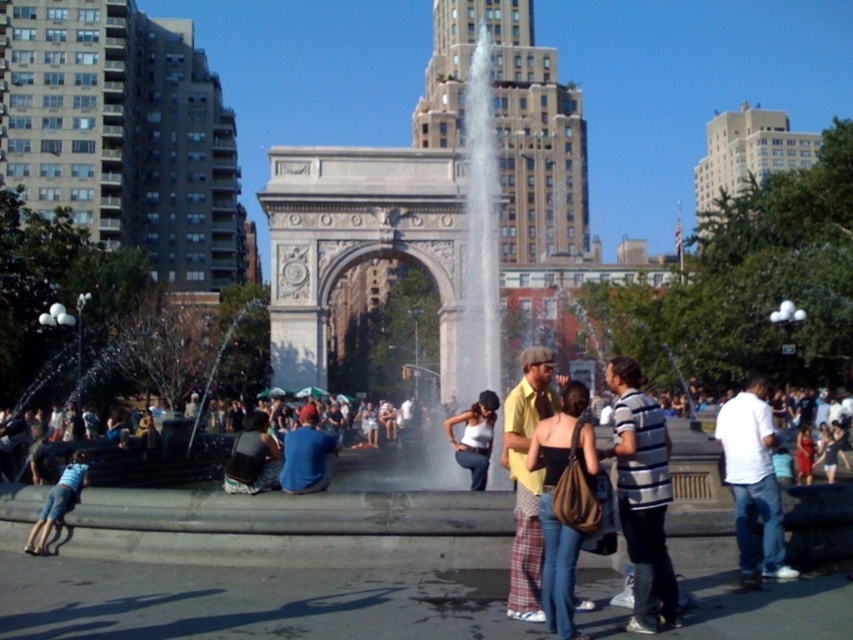
Can you confirm if white cotton shirt at center-right is wider than blue cotton shirt at center?

No.

Consider the image. Is white cotton shirt at center-right below blue cotton shirt at center?

Correct, white cotton shirt at center-right is located below blue cotton shirt at center.

Is point (772, 577) closer to camera compared to point (305, 456)?

Yes, point (772, 577) is closer to viewer.

You are a GUI agent. You are given a task and a screenshot of the screen. Output one action in this format:
    pyautogui.click(x=<x>, y=<y>)
    Task: Click on the white cotton shirt at center-right
    The width and height of the screenshot is (853, 640).
    Given the screenshot: What is the action you would take?
    pyautogui.click(x=752, y=481)

Does matte brown shoulder bag at center have a smaller size compared to blue cotton shirt at center?

Indeed, matte brown shoulder bag at center has a smaller size compared to blue cotton shirt at center.

Who is more forward, (572,602) or (312,436)?

Point (572,602) is in front.

I want to click on matte brown shoulder bag at center, so click(x=553, y=502).

Is striped cotton shirt at center bigger than yellow cotton shirt at center?

No, striped cotton shirt at center is not bigger than yellow cotton shirt at center.

Is striped cotton shirt at center in front of yellow cotton shirt at center?

Yes, it is in front of yellow cotton shirt at center.

Who is more forward, (650, 472) or (524, 400)?

Point (650, 472) is in front.

Identify the location of striped cotton shirt at center. The image size is (853, 640). (642, 496).